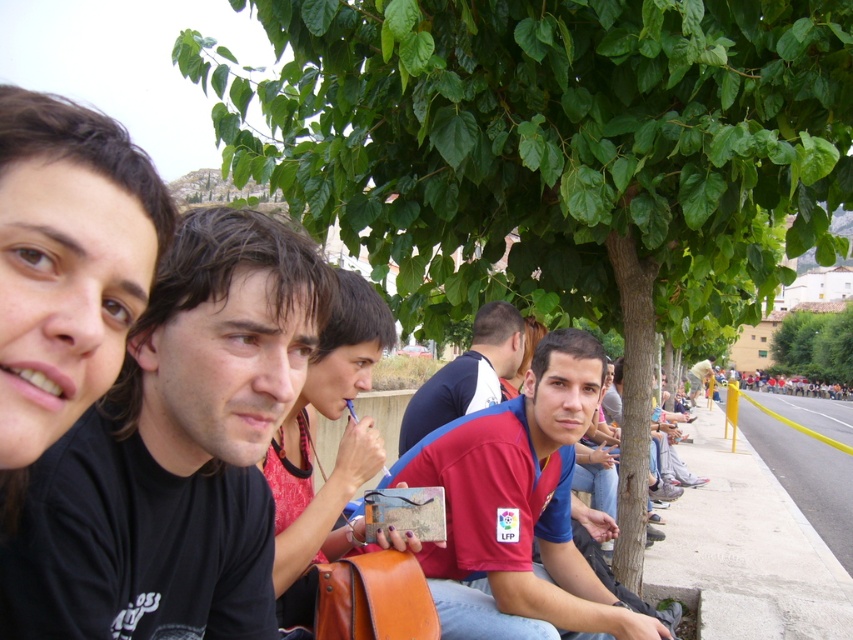
Which is behind, point (339, 442) or point (831, 348)?

Positioned behind is point (831, 348).

Is matte brown guitar at center smaller than green leafy tree at center?

Yes.

Measure the distance between matte brown guitar at center and camera.

matte brown guitar at center and camera are 5.11 meters apart.

Where is `matte brown guitar at center`? This screenshot has height=640, width=853. matte brown guitar at center is located at coordinates (337, 451).

Can you confirm if red fabric shirt at center is bigger than matte brown guitar at center?

Correct, red fabric shirt at center is larger in size than matte brown guitar at center.

Does red fabric shirt at center have a smaller size compared to matte brown guitar at center?

No.

The image size is (853, 640). Describe the element at coordinates (519, 509) in the screenshot. I see `red fabric shirt at center` at that location.

I want to click on red fabric shirt at center, so click(519, 509).

Does black matte shirt at left appear over red fabric shirt at center?

Yes.

Does black matte shirt at left appear on the right side of red fabric shirt at center?

Incorrect, black matte shirt at left is not on the right side of red fabric shirt at center.

Is point (287, 388) in front of point (473, 577)?

Yes, point (287, 388) is closer to viewer.

The image size is (853, 640). I want to click on black matte shirt at left, so click(x=175, y=451).